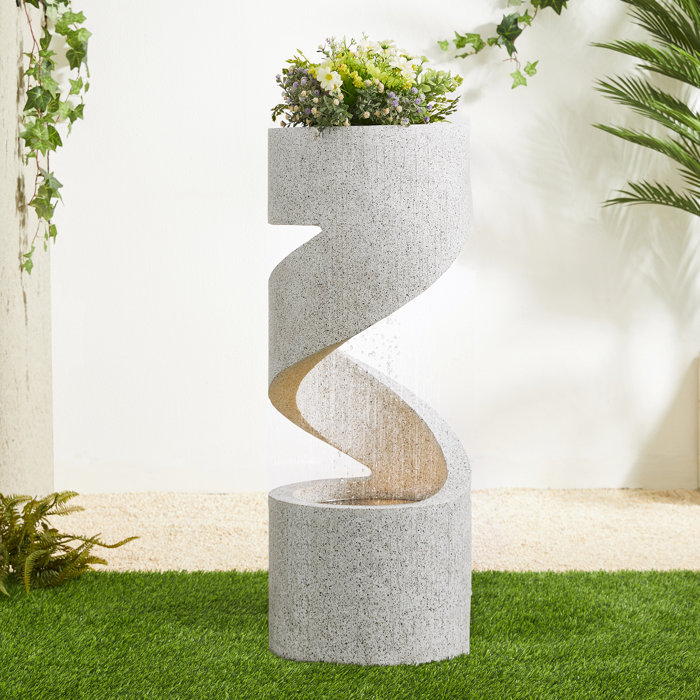
Identify the location of sculpture. (381, 204).